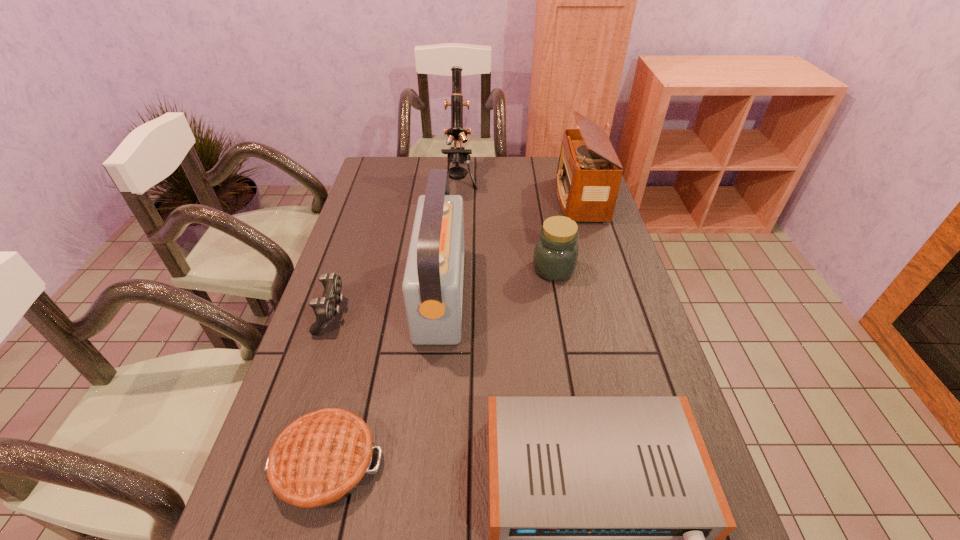
Image resolution: width=960 pixels, height=540 pixels. What are the coordinates of `object positioned at the far right corner` in the screenshot? It's located at (589, 173).

Locate an element on the screen. free space at the far edge of the desktop is located at coordinates (426, 180).

In order to click on free space at the left edge of the desktop in this screenshot , I will do `click(381, 271)`.

You are a GUI agent. You are given a task and a screenshot of the screen. Output one action in this format:
    pyautogui.click(x=<x>, y=<y>)
    Task: Click on the unoccupied area between the shortest object and the tallest object
    
    Given the screenshot: What is the action you would take?
    pyautogui.click(x=393, y=322)

I want to click on vacant point located between the microscope and the farthest radio receiver, so click(x=519, y=191).

You are a GUI agent. You are given a task and a screenshot of the screen. Output one action in this format:
    pyautogui.click(x=<x>, y=<y>)
    Task: Click on the free point between the second farthest radio receiver and the pie
    The width and height of the screenshot is (960, 540).
    Given the screenshot: What is the action you would take?
    pyautogui.click(x=383, y=378)

Image resolution: width=960 pixels, height=540 pixels. What are the coordinates of `empty location between the microscope and the farthest radio receiver` in the screenshot? It's located at (519, 191).

The height and width of the screenshot is (540, 960). I want to click on object that is the fourth closest one to the nearest radio receiver, so click(x=325, y=308).

Identify which object is the fourth closest to the control. Please provide its 2D coordinates. Your answer should be formatted as a tuple, i.e. [(x, y)], where the tuple contains the x and y coordinates of a point satisfying the conditions above.

[(457, 155)]

Select which radio receiver is the closest to the farthest radio receiver. Please provide its 2D coordinates. Your answer should be formatted as a tuple, i.e. [(x, y)], where the tuple contains the x and y coordinates of a point satisfying the conditions above.

[(432, 286)]